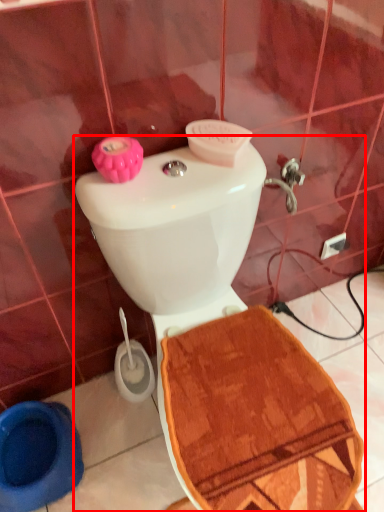
Question: From the image, what is the correct spatial relationship of toilet (annotated by the red box) in relation to toilet bowl?

Choices:
 (A) right
 (B) left

Answer: (A)